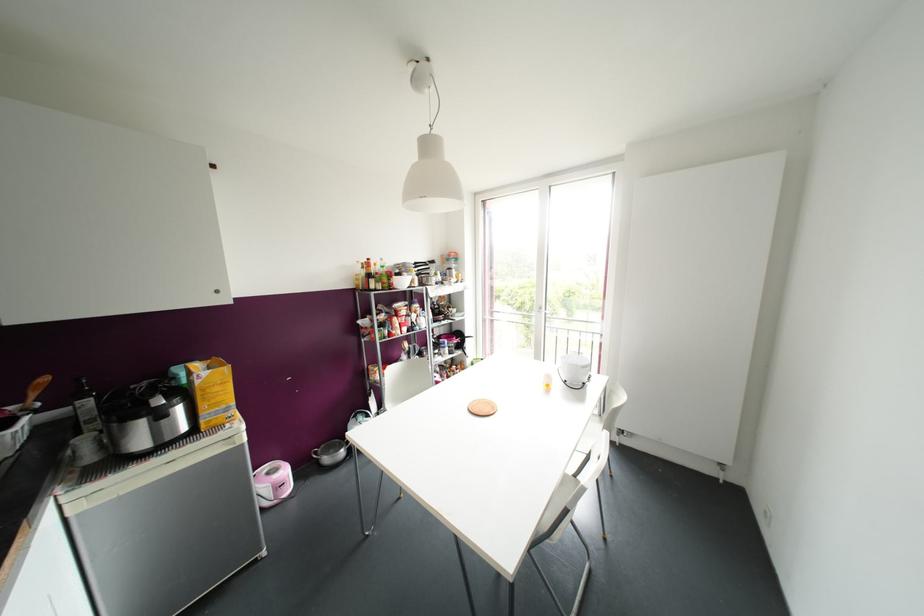
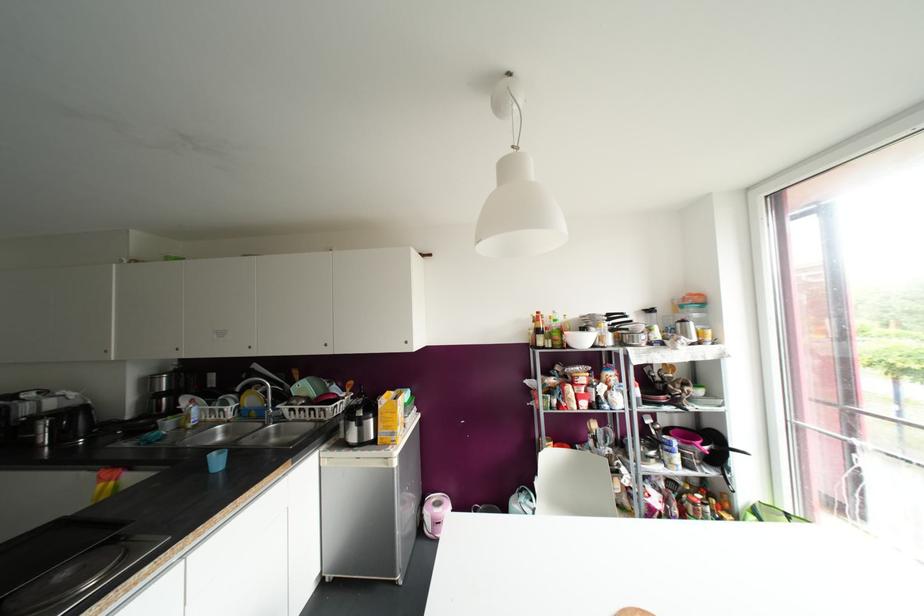
Question: The camera is either moving clockwise (left) or counter-clockwise (right) around the object. The first image is from the beginning of the video and the second image is from the end. Is the camera moving left or right when shooting the video?

Choices:
 (A) Left
 (B) Right

Answer: (B)